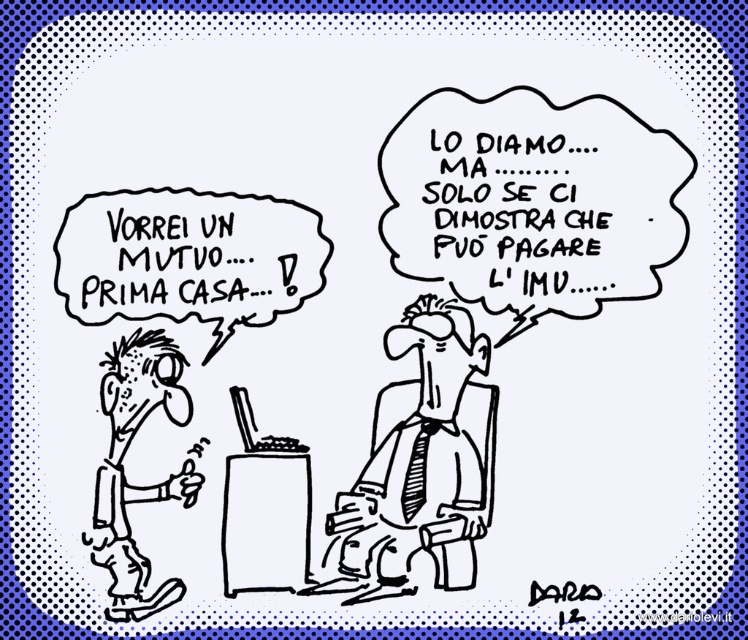
Question: Which point is closer to the camera?

Choices:
 (A) black ink pen at center
 (B) black paperclip at lower left

Answer: (B)

Question: Can you confirm if black ink pen at center is wider than black paperclip at lower left?

Choices:
 (A) no
 (B) yes

Answer: (B)

Question: Is black ink pen at center bigger than black paperclip at lower left?

Choices:
 (A) yes
 (B) no

Answer: (A)

Question: Does black ink pen at center appear over black paperclip at lower left?

Choices:
 (A) no
 (B) yes

Answer: (B)

Question: Which of the following is the closest to the observer?

Choices:
 (A) (119, 401)
 (B) (465, 460)

Answer: (A)